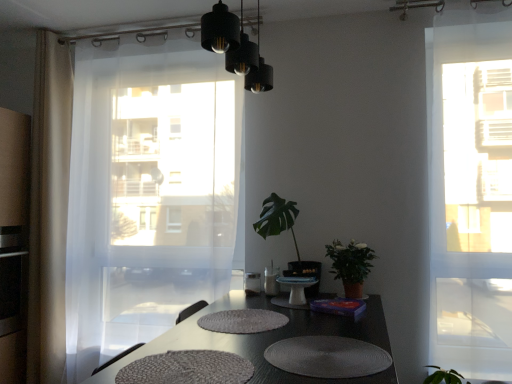
Question: Considering the relative positions of black matte light fixture at upper center and green matte plant at right, the first houseplant viewed from the right, in the image provided, is black matte light fixture at upper center to the right of green matte plant at right, the first houseplant viewed from the right, from the viewer's perspective?

Choices:
 (A) yes
 (B) no

Answer: (B)

Question: Is black matte light fixture at upper center taller than green matte plant at right, the second houseplant from the left?

Choices:
 (A) no
 (B) yes

Answer: (B)

Question: Does black matte light fixture at upper center appear on the left side of green matte plant at right, the second houseplant from the left?

Choices:
 (A) yes
 (B) no

Answer: (A)

Question: Is green matte plant at right, the first houseplant viewed from the right, a part of black matte light fixture at upper center?

Choices:
 (A) no
 (B) yes

Answer: (A)

Question: From a real-world perspective, is black matte light fixture at upper center physically below green matte plant at right, the second houseplant from the left?

Choices:
 (A) yes
 (B) no

Answer: (B)

Question: Is point (95, 225) positioned closer to the camera than point (260, 344)?

Choices:
 (A) closer
 (B) farther

Answer: (B)

Question: Based on their sizes in the image, would you say transparent white curtain at left, the 1th curtain viewed from the right, is bigger or smaller than textured gray placemats at center?

Choices:
 (A) small
 (B) big

Answer: (B)

Question: From a real-world perspective, is transparent white curtain at left, the 1th curtain viewed from the right, positioned above or below textured gray placemats at center?

Choices:
 (A) above
 (B) below

Answer: (A)

Question: Choose the correct answer: Is transparent white curtain at left, the 1th curtain viewed from the right, inside textured gray placemats at center or outside it?

Choices:
 (A) inside
 (B) outside

Answer: (B)

Question: Considering the positions of black matte light fixture at upper center and beige sheer curtain at left, the 2th curtain when ordered from right to left, in the image, is black matte light fixture at upper center bigger or smaller than beige sheer curtain at left, the 2th curtain when ordered from right to left,?

Choices:
 (A) small
 (B) big

Answer: (A)

Question: From a real-world perspective, is black matte light fixture at upper center above or below beige sheer curtain at left, acting as the 1th curtain starting from the left?

Choices:
 (A) below
 (B) above

Answer: (B)

Question: Visually, is black matte light fixture at upper center positioned to the left or to the right of beige sheer curtain at left, the 2th curtain when ordered from right to left?

Choices:
 (A) left
 (B) right

Answer: (B)

Question: From the image's perspective, is black matte light fixture at upper center positioned above or below beige sheer curtain at left, acting as the 1th curtain starting from the left?

Choices:
 (A) above
 (B) below

Answer: (A)

Question: From the image's perspective, is white textured placemat at lower center, the 2th wide viewed from the left, located above or below white textured placemat at center?

Choices:
 (A) above
 (B) below

Answer: (A)

Question: Is point (353, 342) closer or farther from the camera than point (228, 319)?

Choices:
 (A) farther
 (B) closer

Answer: (B)